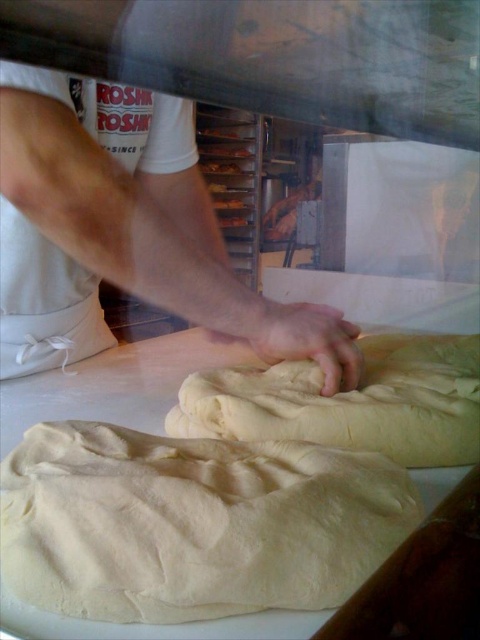
You are a customer in the bakery and want to know where the white fabric arm at upper left is located. Can you tell me its exact position in the image?

The white fabric arm at upper left is located at point (124, 228).

From the picture: You are a baker who needs to reach the white fluffy dough at center. If your arm can extend 30 centimeters, can you reach it without moving closer?

The white fluffy dough at center is 31.63 centimeters away from the viewer. Since your arm can only extend 30 centimeters, you cannot reach it without moving closer.

You are a customer observing the baker at work. You notice the white fabric arm at upper left and the smooth white hand at center. Which object is closer to you?

The white fabric arm at upper left is closer to you because it is positioned over the smooth white hand at center.